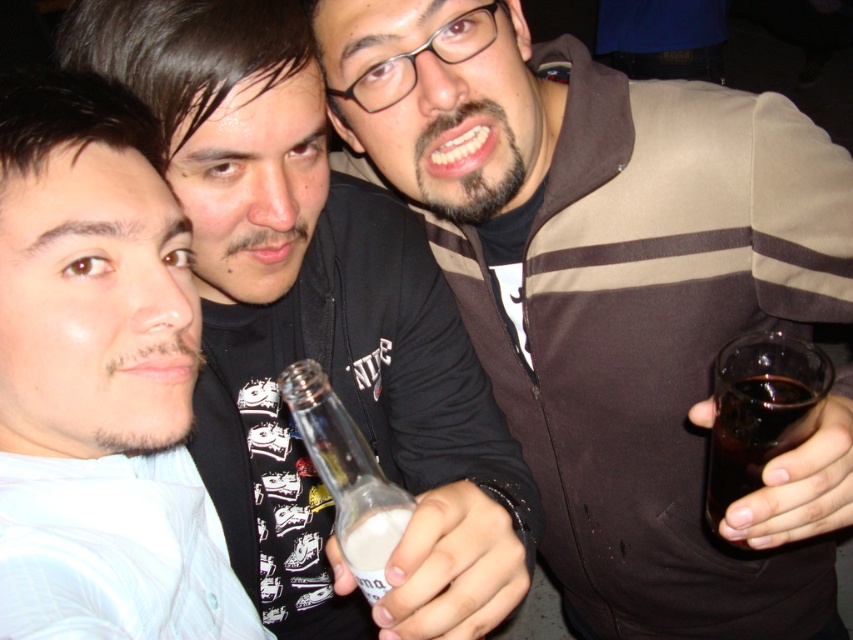
Question: Can you confirm if white matte shirt at left is thinner than dark glass at right?

Choices:
 (A) yes
 (B) no

Answer: (B)

Question: Which point is farther to the camera?

Choices:
 (A) clear glass bottle at center
 (B) dark glass at right

Answer: (B)

Question: Which is farther from the brown fabric jacket at upper right?

Choices:
 (A) dark glass at right
 (B) matte black shirt at center
 (C) white matte shirt at left

Answer: (C)

Question: Does matte black shirt at center appear under clear glass bottle at center?

Choices:
 (A) no
 (B) yes

Answer: (B)

Question: Observing the image, what is the correct spatial positioning of white matte shirt at left in reference to dark glass at right?

Choices:
 (A) above
 (B) below

Answer: (A)

Question: Which object appears closest to the camera in this image?

Choices:
 (A) dark glass at right
 (B) clear glass bottle at center
 (C) white matte shirt at left
 (D) matte black shirt at center

Answer: (C)